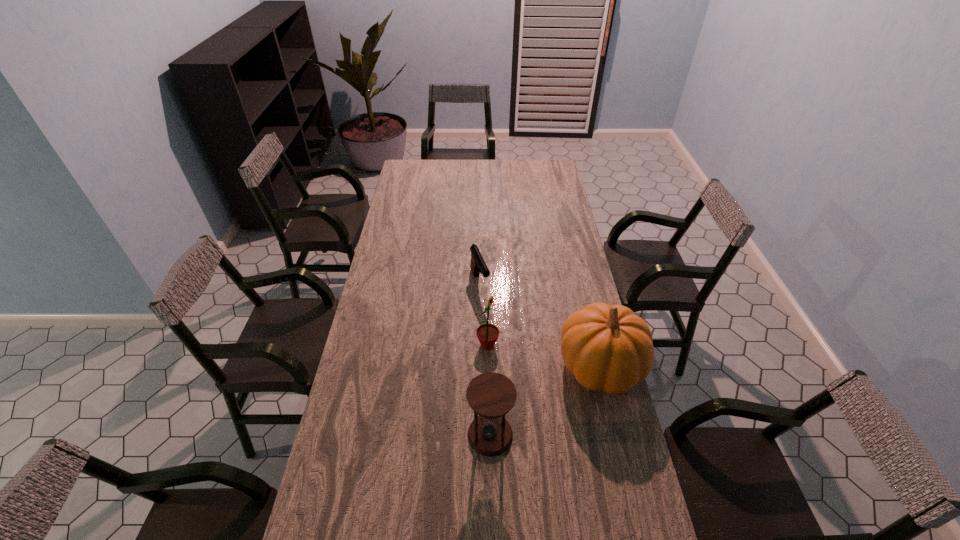
Locate an element on the screen. The image size is (960, 540). free spot on the desktop that is between the nearest object and the pumpkin and is positioned on the face of the sunflower is located at coordinates (558, 393).

You are a GUI agent. You are given a task and a screenshot of the screen. Output one action in this format:
    pyautogui.click(x=<x>, y=<y>)
    Task: Click on the free spot on the desktop that is between the hourglass and the pumpkin and is positioned at the barrel of the pistol
    
    Given the screenshot: What is the action you would take?
    pyautogui.click(x=537, y=406)